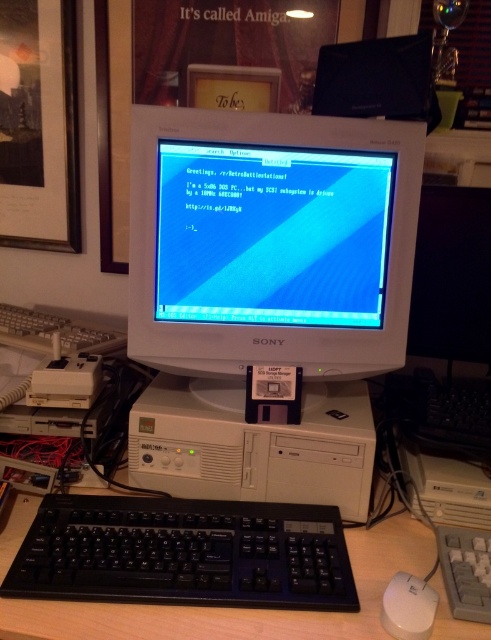
Does white plastic monitor at upper center have a smaller size compared to white plastic mouse at lower right?

No.

Can you confirm if white plastic monitor at upper center is positioned to the left of white plastic mouse at lower right?

Indeed, white plastic monitor at upper center is positioned on the left side of white plastic mouse at lower right.

The width and height of the screenshot is (491, 640). In order to click on white plastic monitor at upper center in this screenshot , I will do tap(233, 88).

Between point (221, 136) and point (174, 476), which one is positioned behind?

Positioned behind is point (174, 476).

Does point (343, 339) come closer to viewer compared to point (239, 392)?

Yes, point (343, 339) is in front of point (239, 392).

Locate an element on the screen. The height and width of the screenshot is (640, 491). white plastic monitor at center is located at coordinates (267, 294).

Does black plastic keyboard at lower center come behind white plastic monitor at upper center?

No.

Does black plastic keyboard at lower center appear on the right side of white plastic monitor at upper center?

Incorrect, black plastic keyboard at lower center is not on the right side of white plastic monitor at upper center.

You are a GUI agent. You are given a task and a screenshot of the screen. Output one action in this format:
    pyautogui.click(x=<x>, y=<y>)
    Task: Click on the black plastic keyboard at lower center
    The height and width of the screenshot is (640, 491).
    Given the screenshot: What is the action you would take?
    pyautogui.click(x=184, y=554)